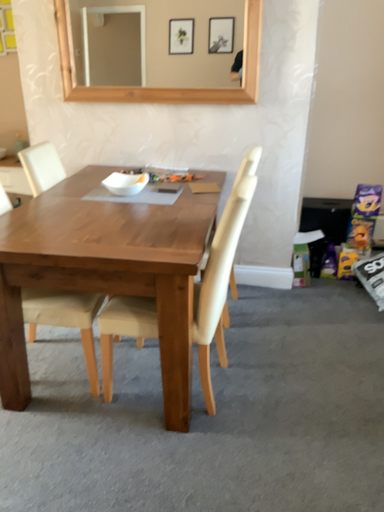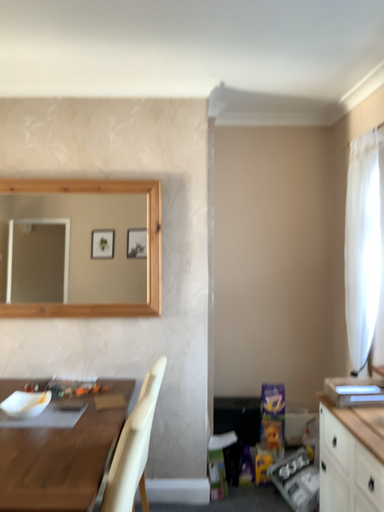
Question: Which way did the camera rotate in the video?

Choices:
 (A) rotated downward
 (B) rotated upward

Answer: (B)